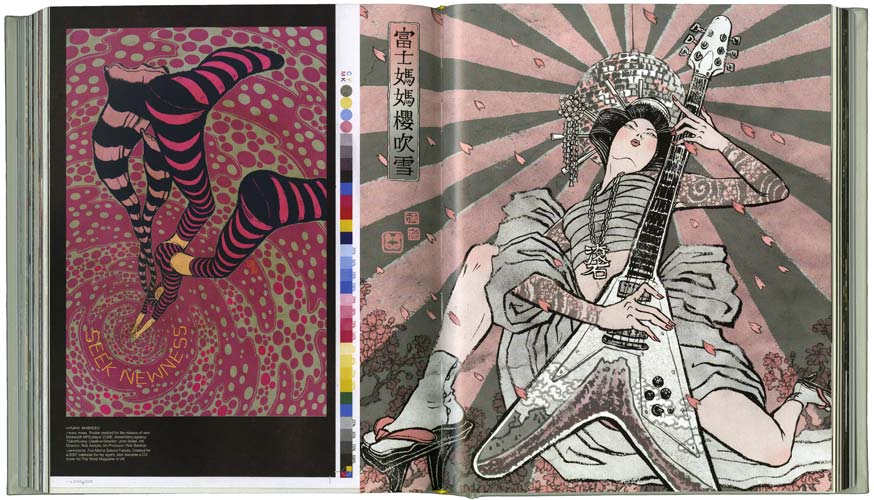
Find the location of a particular element. This screenshot has width=874, height=500. disco ball is located at coordinates (632, 80), (607, 82).